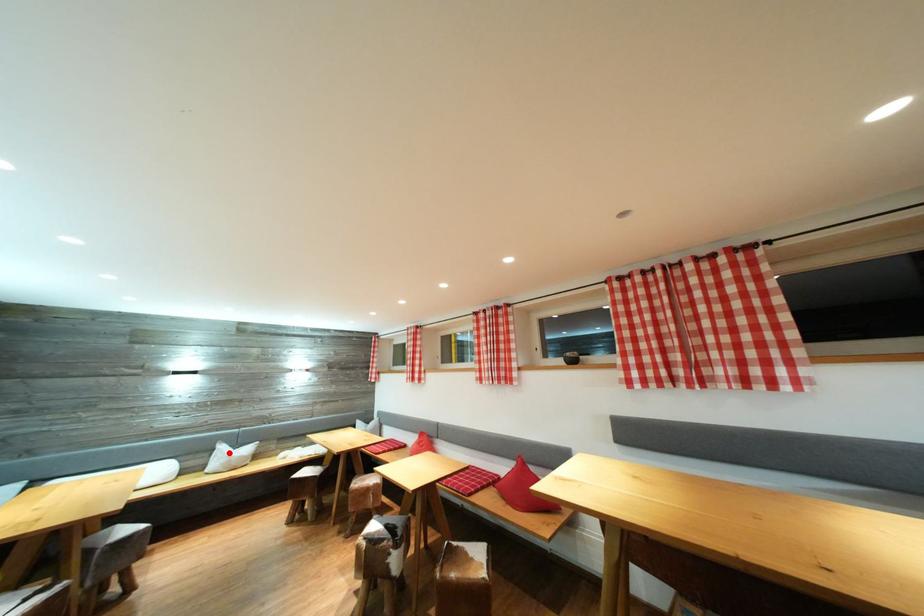
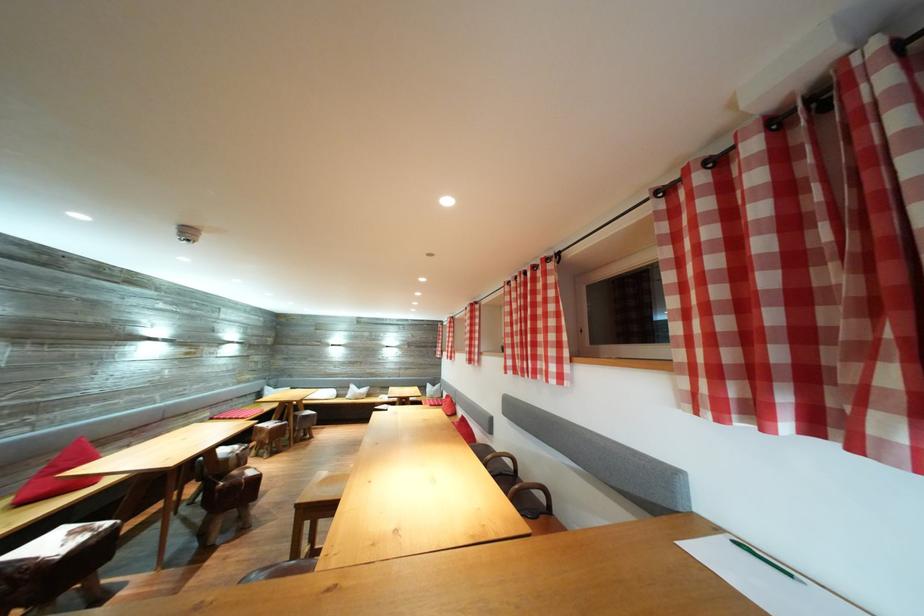
Question: I am providing you with two images of the same scene from different viewpoints. A red point is shown in image1. For the corresponding object point in image2, is it positioned nearer or farther from the camera?

Choices:
 (A) Nearer
 (B) Farther

Answer: (B)